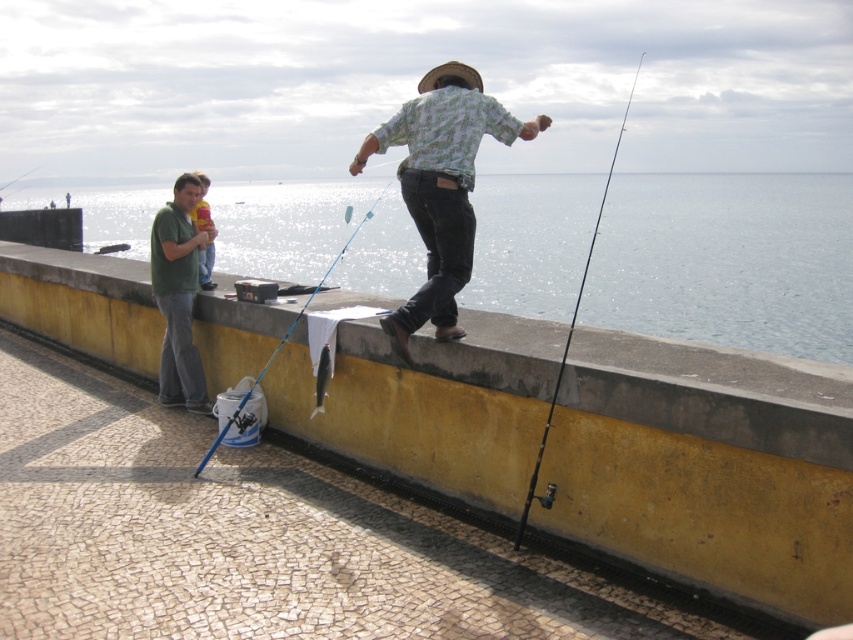
Question: Which object is positioned closest to the matte green shirt at left?

Choices:
 (A) shiny silver fish at center
 (B) blue metallic fishing pole at left

Answer: (A)

Question: Is the position of floral shirt at center less distant than that of black matte fishing pole at center?

Choices:
 (A) no
 (B) yes

Answer: (A)

Question: Where is shiny silver fish at center located in relation to blue metallic fishing pole at left in the image?

Choices:
 (A) below
 (B) above

Answer: (A)

Question: Which point is closer to the camera taking this photo?

Choices:
 (A) click(555, 204)
 (B) click(428, 305)
 (C) click(169, 321)

Answer: (B)

Question: Among these objects, which one is nearest to the camera?

Choices:
 (A) matte green shirt at left
 (B) shiny silver fish at center
 (C) clear blue water at center

Answer: (C)

Question: Is matte green shirt at left thinner than blue metallic fishing pole at left?

Choices:
 (A) no
 (B) yes

Answer: (A)